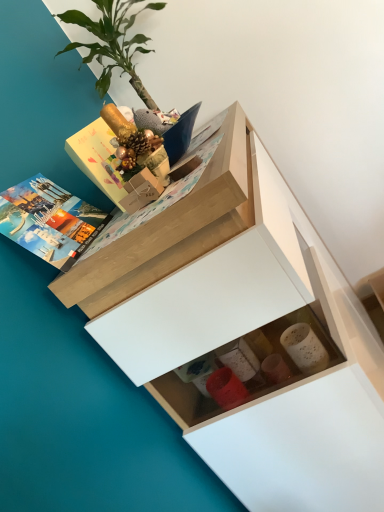
Question: Considering the relative sizes of matte hardcover book at upper left and white matte chest of drawers at upper center in the image provided, is matte hardcover book at upper left wider than white matte chest of drawers at upper center?

Choices:
 (A) yes
 (B) no

Answer: (B)

Question: Does matte hardcover book at upper left lie in front of white matte chest of drawers at upper center?

Choices:
 (A) no
 (B) yes

Answer: (A)

Question: Is matte hardcover book at upper left thinner than white matte chest of drawers at upper center?

Choices:
 (A) no
 (B) yes

Answer: (B)

Question: Is the position of matte hardcover book at upper left more distant than that of white matte chest of drawers at upper center?

Choices:
 (A) no
 (B) yes

Answer: (B)

Question: Can you confirm if matte hardcover book at upper left is taller than white matte chest of drawers at upper center?

Choices:
 (A) yes
 (B) no

Answer: (B)

Question: From the image's perspective, relative to white matte chest of drawers at upper center, is green leafy plant at upper left above or below?

Choices:
 (A) above
 (B) below

Answer: (A)

Question: In terms of width, does green leafy plant at upper left look wider or thinner when compared to white matte chest of drawers at upper center?

Choices:
 (A) thin
 (B) wide

Answer: (A)

Question: Is green leafy plant at upper left bigger or smaller than white matte chest of drawers at upper center?

Choices:
 (A) small
 (B) big

Answer: (A)

Question: In the image, is green leafy plant at upper left on the left side or the right side of white matte chest of drawers at upper center?

Choices:
 (A) right
 (B) left

Answer: (B)

Question: Which is correct: white matte chest of drawers at upper center is inside green leafy plant at upper left, or outside of it?

Choices:
 (A) outside
 (B) inside

Answer: (A)

Question: In terms of size, does white matte chest of drawers at upper center appear bigger or smaller than green leafy plant at upper left?

Choices:
 (A) small
 (B) big

Answer: (B)

Question: Based on their positions, is white matte chest of drawers at upper center located to the left or right of green leafy plant at upper left?

Choices:
 (A) left
 (B) right

Answer: (B)

Question: From the image's perspective, is white matte chest of drawers at upper center located above or below green leafy plant at upper left?

Choices:
 (A) above
 (B) below

Answer: (B)

Question: From the image's perspective, is white matte chest of drawers at upper center above or below matte hardcover book at upper left?

Choices:
 (A) above
 (B) below

Answer: (B)

Question: Based on their sizes in the image, would you say white matte chest of drawers at upper center is bigger or smaller than matte hardcover book at upper left?

Choices:
 (A) big
 (B) small

Answer: (A)